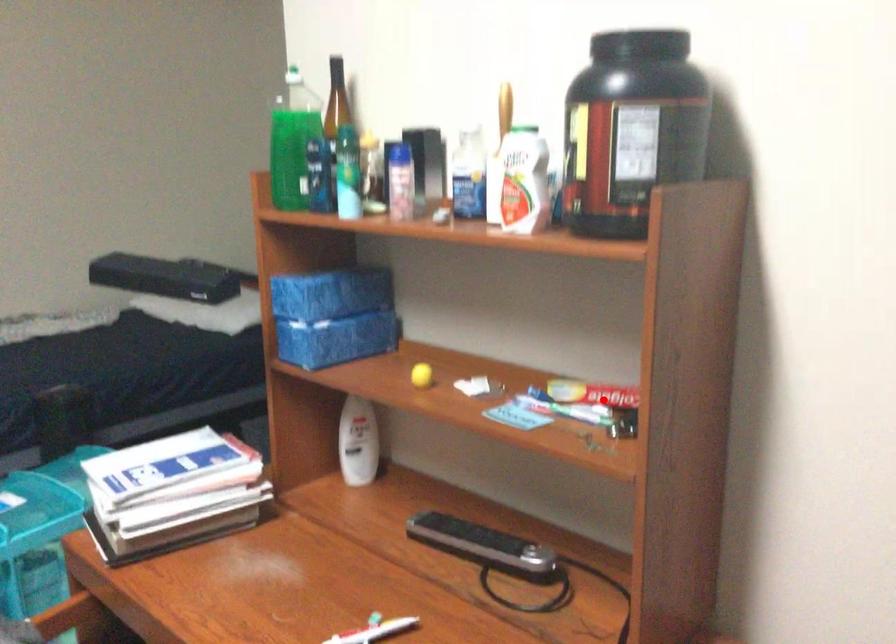
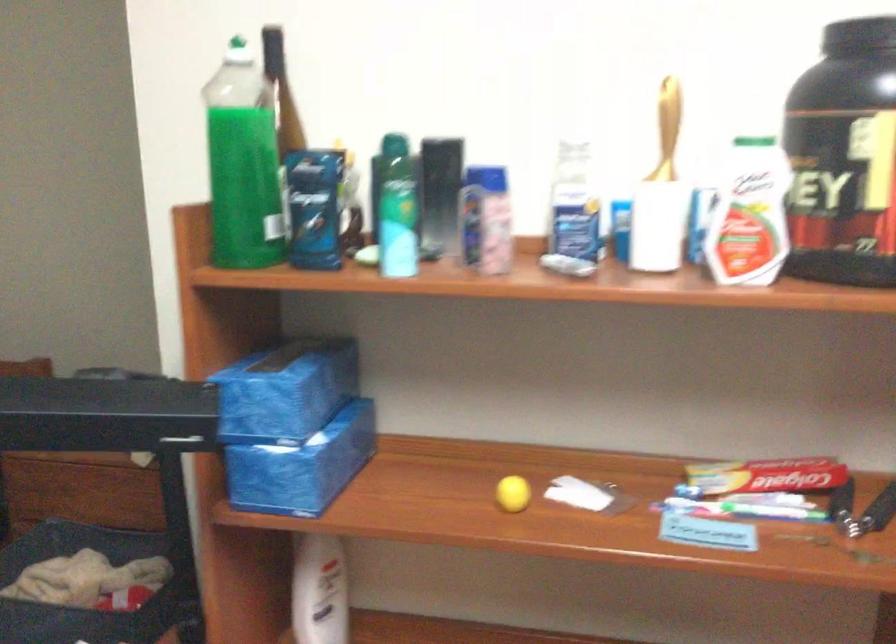
Find the pixel in the second image that matches the highlighted location in the first image.

(764, 483)